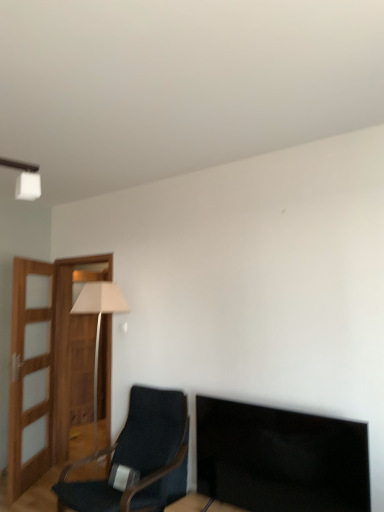
Question: In the image, is dark blue fabric chair at lower left on the left side or the right side of matte beige lamp at left?

Choices:
 (A) left
 (B) right

Answer: (B)

Question: From the image's perspective, is dark blue fabric chair at lower left above or below matte beige lamp at left?

Choices:
 (A) below
 (B) above

Answer: (A)

Question: From a real-world perspective, relative to matte beige lamp at left, is dark blue fabric chair at lower left vertically above or below?

Choices:
 (A) below
 (B) above

Answer: (A)

Question: Looking at the image, does matte beige lamp at left seem bigger or smaller compared to dark blue fabric chair at lower left?

Choices:
 (A) big
 (B) small

Answer: (B)

Question: Choose the correct answer: Is matte beige lamp at left inside dark blue fabric chair at lower left or outside it?

Choices:
 (A) outside
 (B) inside

Answer: (A)

Question: From a real-world perspective, is matte beige lamp at left physically located above or below dark blue fabric chair at lower left?

Choices:
 (A) above
 (B) below

Answer: (A)

Question: From the image's perspective, is matte beige lamp at left positioned above or below dark blue fabric chair at lower left?

Choices:
 (A) below
 (B) above

Answer: (B)